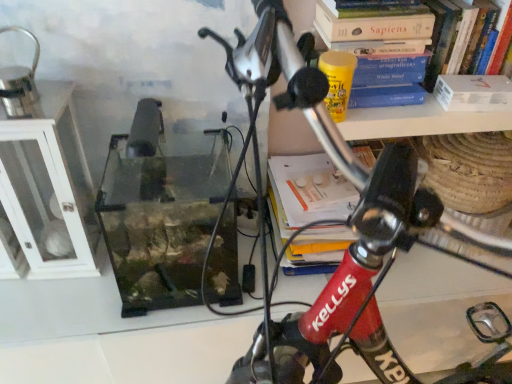
The image size is (512, 384). Identify the location of vacant space in front of white glass cabinet at left. (57, 308).